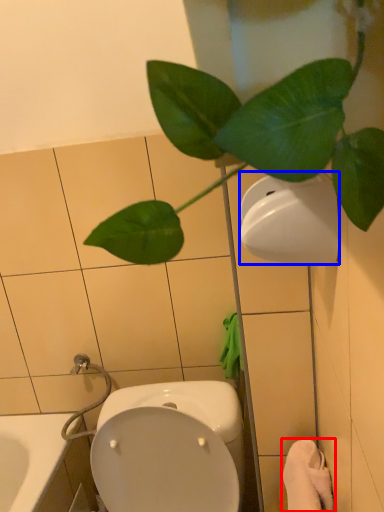
Question: Which object is closer to the camera taking this photo, bath towel (highlighted by a red box) or toilet paper (highlighted by a blue box)?

Choices:
 (A) bath towel
 (B) toilet paper

Answer: (B)